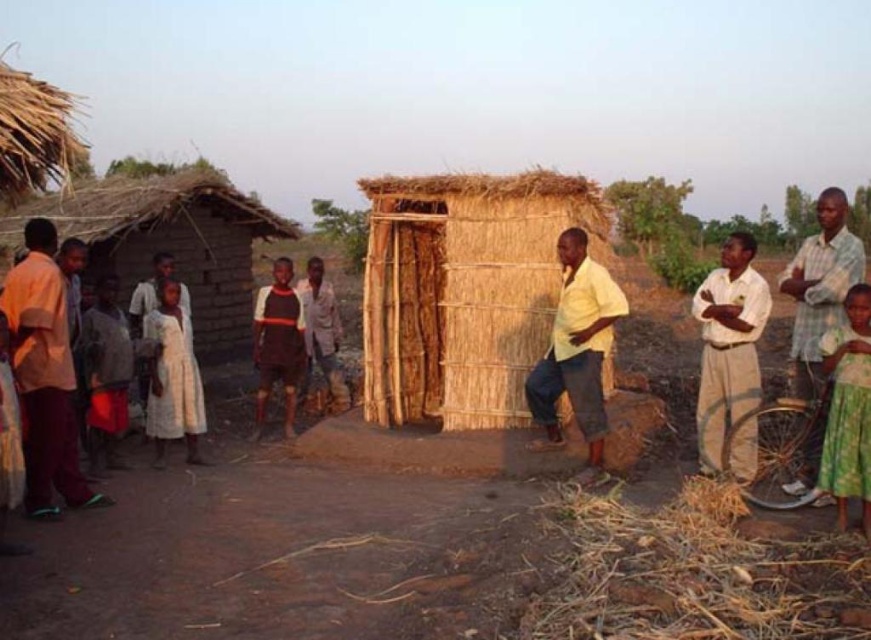
Question: Among these points, which one is farthest from the camera?

Choices:
 (A) (192, 400)
 (B) (261, 419)

Answer: (B)

Question: From the image, what is the correct spatial relationship of brown straw hay at lower right in relation to yellow matte shirt at center?

Choices:
 (A) below
 (B) above

Answer: (A)

Question: Does checkered fabric shirt at right appear on the right side of dark brown fabric shirt at center?

Choices:
 (A) no
 (B) yes

Answer: (B)

Question: Can you confirm if brown straw hay at lower right is positioned to the right of light brown fabric shirt at left?

Choices:
 (A) yes
 (B) no

Answer: (A)

Question: Estimate the real-world distances between objects in this image. Which object is farther from the white cotton shirt at right?

Choices:
 (A) light brown fabric shirt at left
 (B) brown straw hay at lower right
 (C) yellow matte shirt at center
 (D) checkered fabric shirt at right

Answer: (A)

Question: Which object appears farthest from the camera in this image?

Choices:
 (A) white cotton dress at center
 (B) dark brown fabric shirt at center
 (C) white cotton shirt at right
 (D) yellow matte shirt at center

Answer: (B)